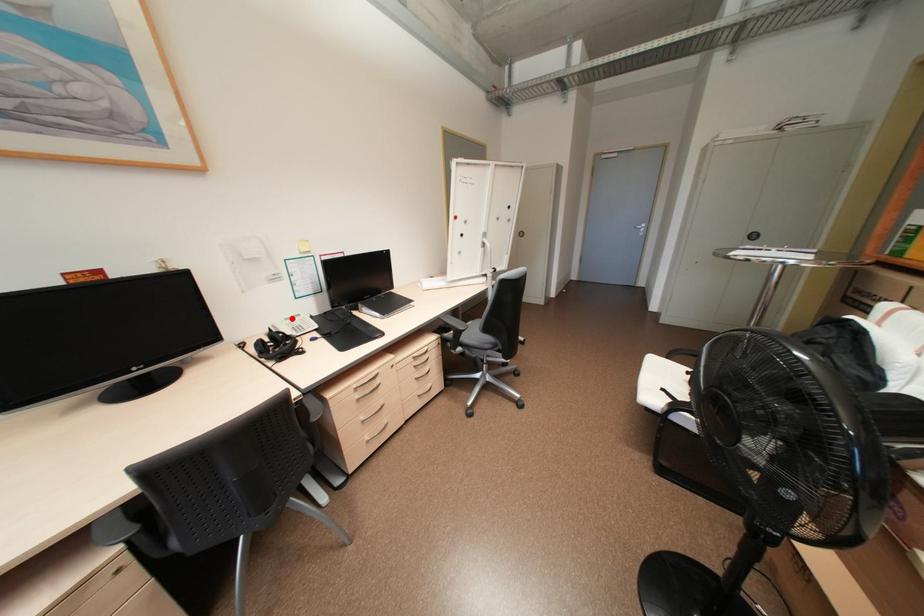
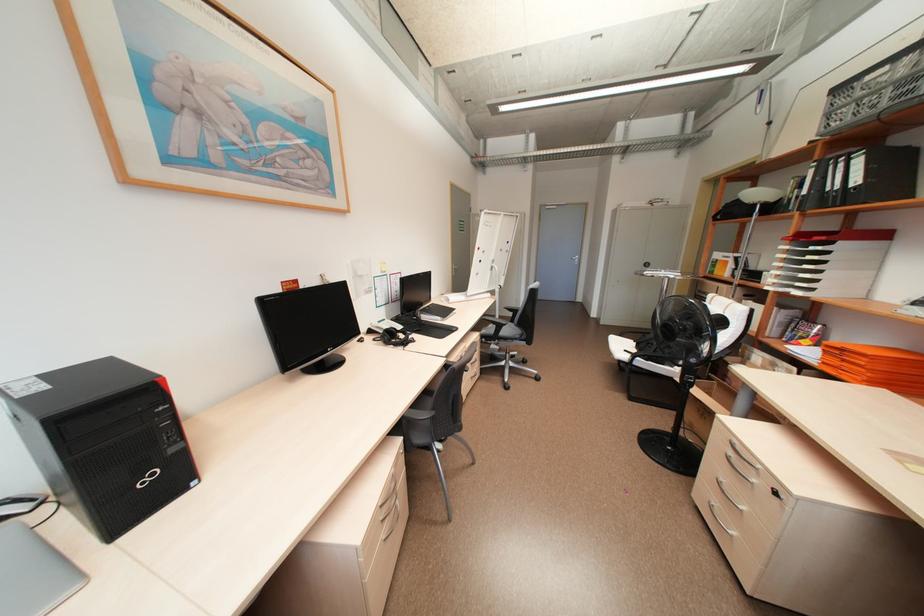
In the second image, find the point that corresponds to the highlighted location in the first image.

(384, 322)